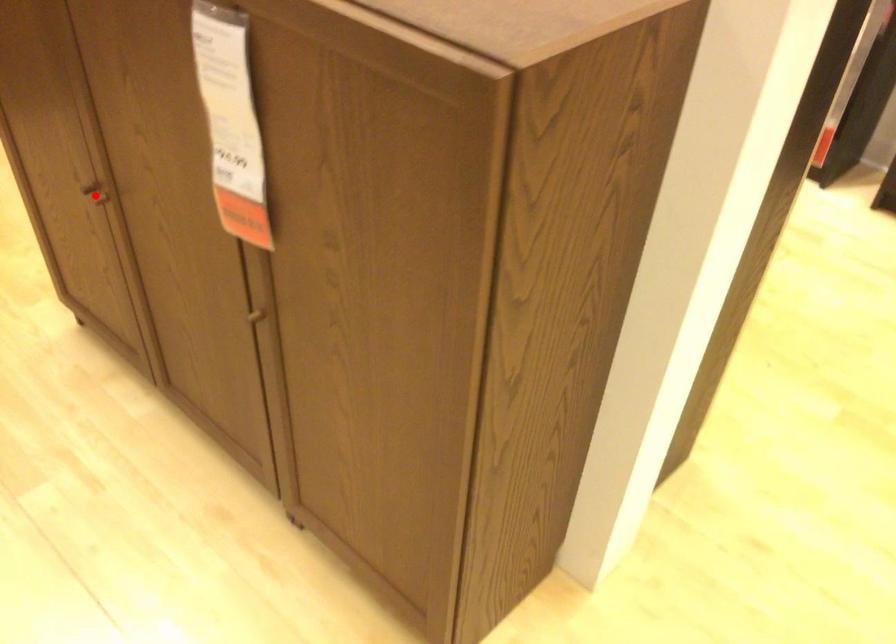
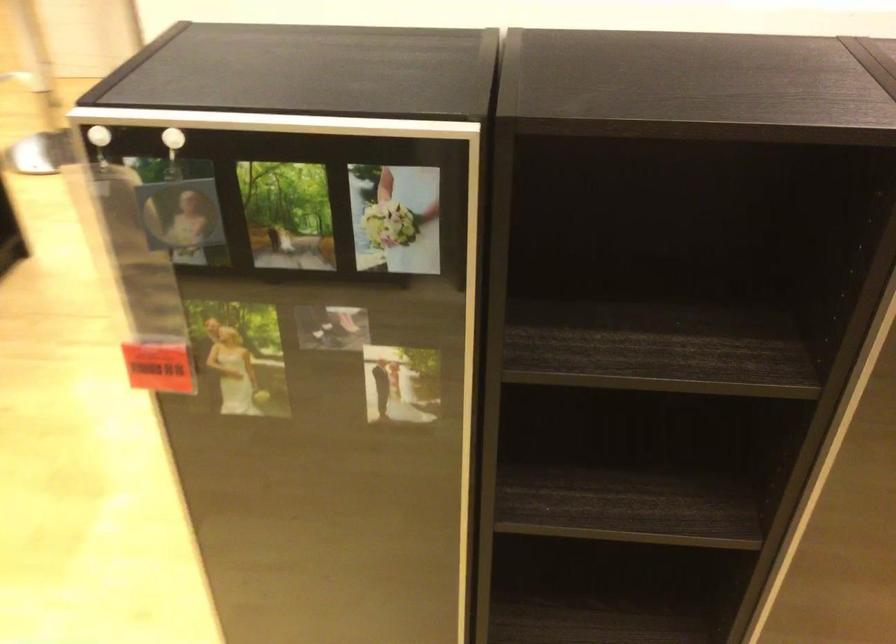
Question: I am providing you with two images of the same scene from different viewpoints. A red point is marked on the first image. Is the red point's position out of view in image 2?

Choices:
 (A) Yes
 (B) No

Answer: (A)